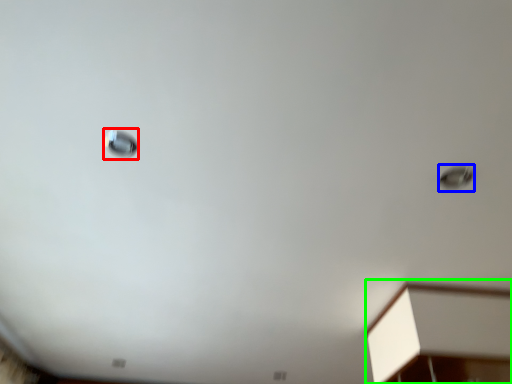
Question: Considering the real-world distances, which object is farthest from droplight (highlighted by a red box)? droplight (highlighted by a blue box) or furniture (highlighted by a green box)?

Choices:
 (A) droplight
 (B) furniture

Answer: (B)